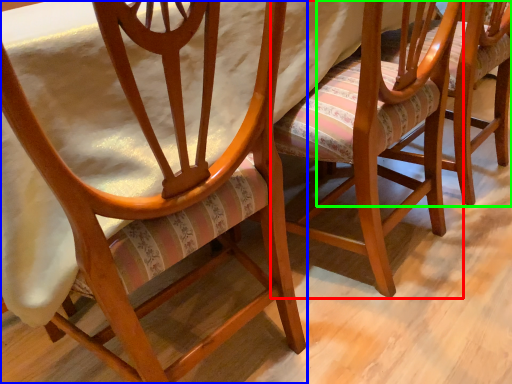
Question: Which is nearer to the chair (highlighted by a red box)? chair (highlighted by a blue box) or chair (highlighted by a green box).

Choices:
 (A) chair
 (B) chair

Answer: (B)